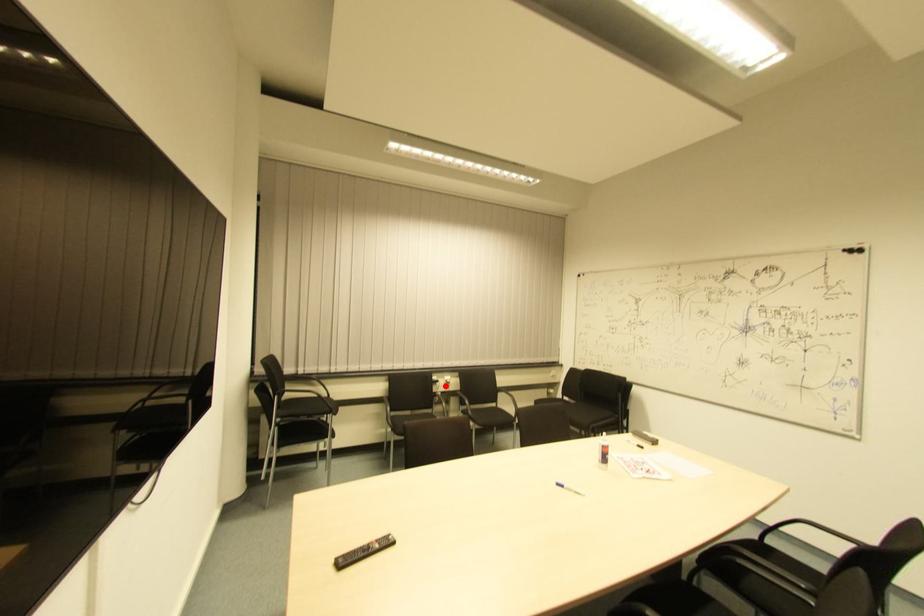
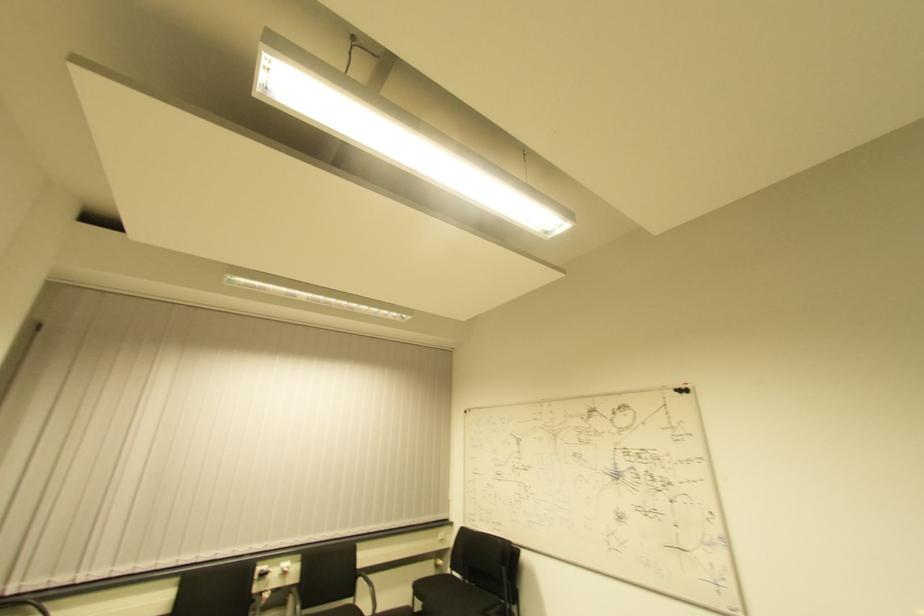
The point at the highlighted location is marked in the first image. Where is the corresponding point in the second image?

(283, 576)